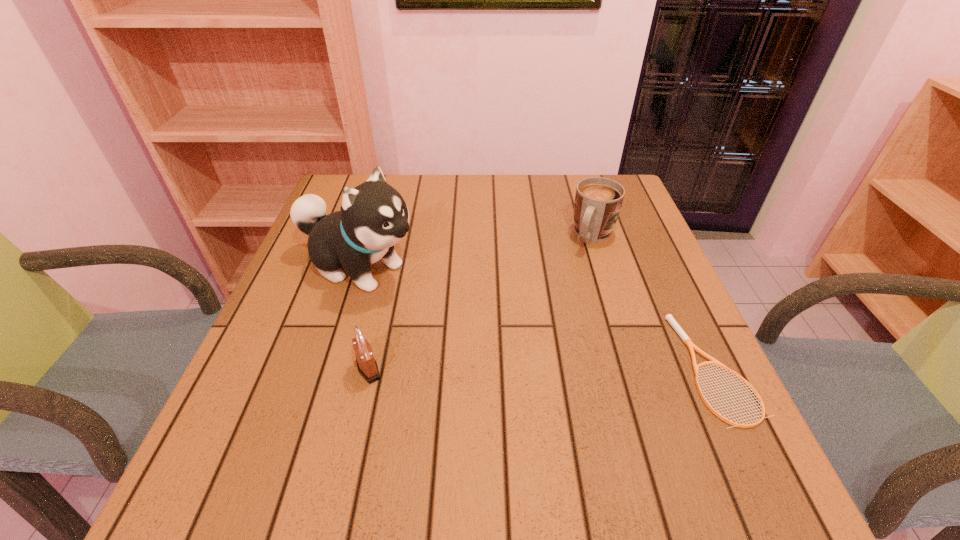
I want to click on blank space located 0.130m on the side of the third object from left to right with the handle, so click(571, 284).

Where is `vacant space located 0.110m on the side of the third object from left to right with the handle`? The width and height of the screenshot is (960, 540). vacant space located 0.110m on the side of the third object from left to right with the handle is located at coordinates (574, 279).

The image size is (960, 540). I want to click on blank space located on the side of the third object from left to right with the handle, so [x=527, y=366].

Find the location of a particular element. object located in the far edge section of the desktop is located at coordinates (598, 201).

Find the location of a particular element. The width and height of the screenshot is (960, 540). object situated at the near edge is located at coordinates (669, 317).

Locate an element on the screen. object located at the left edge is located at coordinates (373, 217).

You are a GUI agent. You are given a task and a screenshot of the screen. Output one action in this format:
    pyautogui.click(x=<x>, y=<y>)
    Task: Click on the tennis racket that is at the right edge
    The image size is (960, 540).
    Given the screenshot: What is the action you would take?
    pyautogui.click(x=669, y=317)

This screenshot has width=960, height=540. I want to click on mug positioned at the right edge, so click(x=598, y=201).

The image size is (960, 540). In order to click on object located at the far right corner in this screenshot , I will do `click(598, 201)`.

This screenshot has width=960, height=540. What are the coordinates of `object located in the near right corner section of the desktop` in the screenshot? It's located at (669, 317).